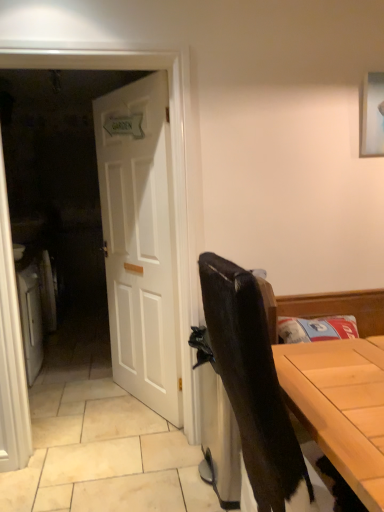
At what (x,y) coordinates should I click in order to perform the action: click on unoccupied area in front of white wooden door at left. Please return your answer as a coordinate pair (x, y). Looking at the image, I should click on (101, 483).